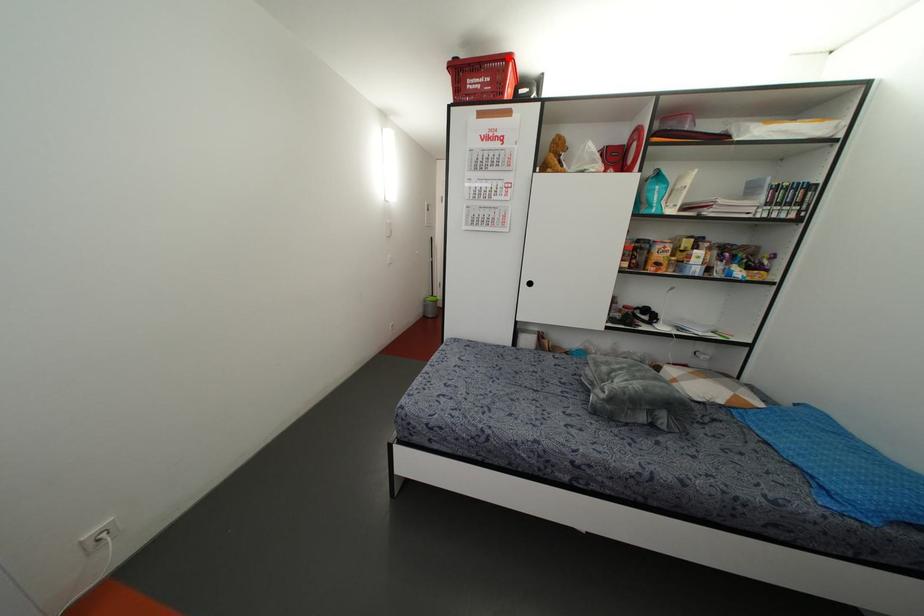
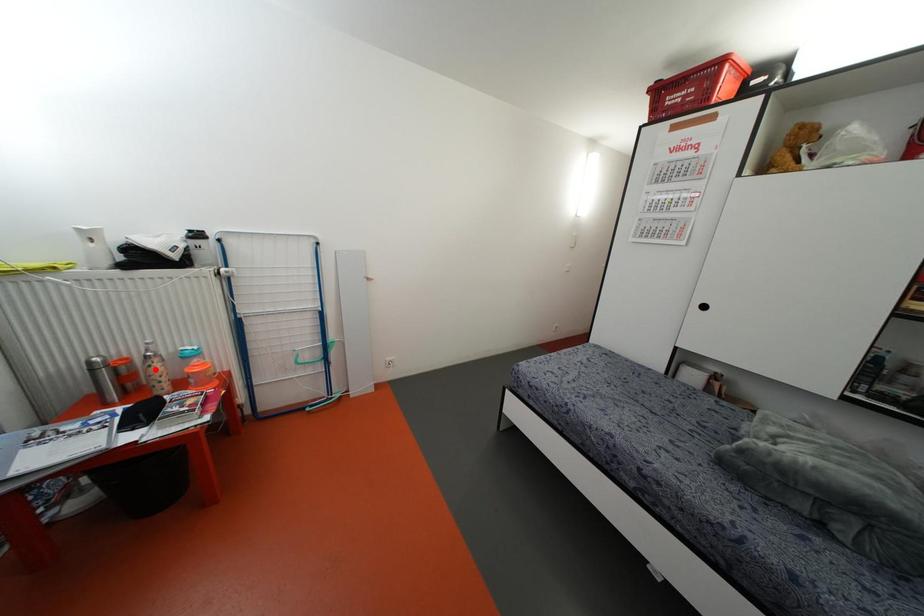
I am providing you with two images of the same scene from different viewpoints. A red point is marked on the first image and another point is marked on the second image. Are the points marked in image1 and image2 representing the same 3D position?

No